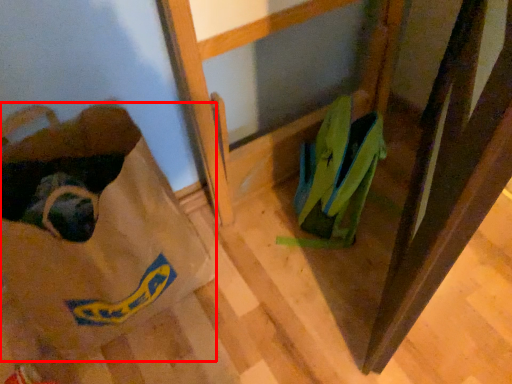
Question: In this image, where is grocery bag (annotated by the red box) located relative to footwear?

Choices:
 (A) left
 (B) right

Answer: (A)